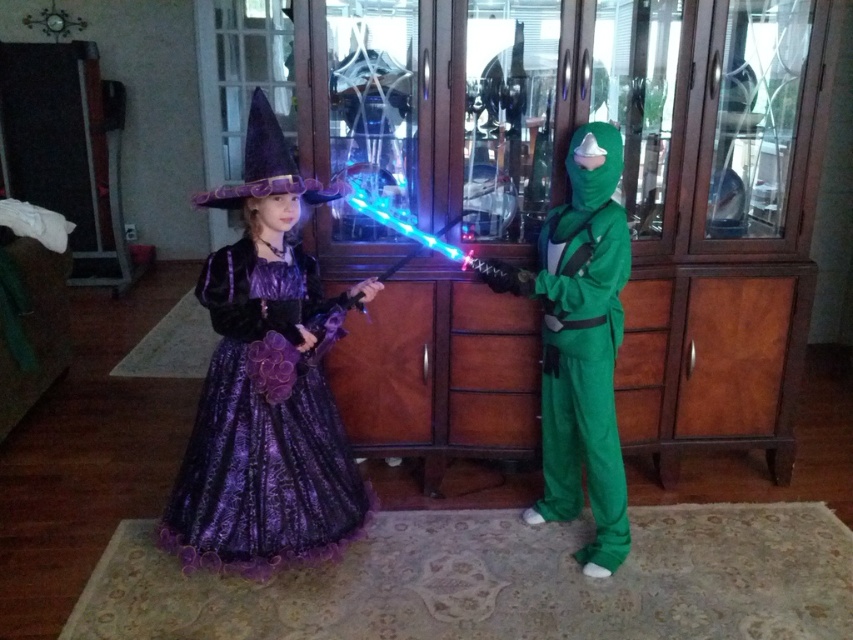
Question: Estimate the real-world distances between objects in this image. Which object is closer to the purple satin witch hat at upper center?

Choices:
 (A) green matte jumpsuit at right
 (B) shiny purple dress at center

Answer: (B)

Question: Which object appears farthest from the camera in this image?

Choices:
 (A) purple satin witch hat at upper center
 (B) green matte jumpsuit at right

Answer: (B)

Question: Among these objects, which one is farthest from the camera?

Choices:
 (A) shiny purple dress at center
 (B) purple satin witch hat at upper center
 (C) green matte jumpsuit at right

Answer: (C)

Question: Does green matte jumpsuit at right come behind purple satin witch hat at upper center?

Choices:
 (A) yes
 (B) no

Answer: (A)

Question: Does green matte jumpsuit at right appear over purple satin witch hat at upper center?

Choices:
 (A) no
 (B) yes

Answer: (A)

Question: Does shiny purple dress at center appear under green matte jumpsuit at right?

Choices:
 (A) yes
 (B) no

Answer: (A)